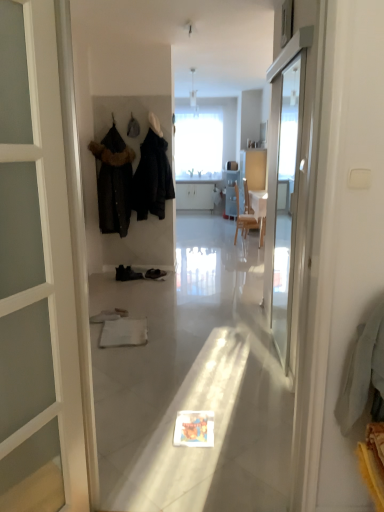
This screenshot has width=384, height=512. Identify the location of black fur-trimmed coat at left, which ranks as the first clothing in left-to-right order. (114, 182).

At what (x,y) coordinates should I click in order to perform the action: click on dark matte coat at center, placed as the 2th clothing when sorted from left to right. Please return your answer as a coordinate pair (x, y). The image size is (384, 512). Looking at the image, I should click on pyautogui.click(x=152, y=178).

What are the coordinates of `black fur-trimmed coat at left, which ranks as the first clothing in left-to-right order` in the screenshot? It's located at (114, 182).

From a real-world perspective, is transparent glass screen door at right above or below dark matte coat at center, placed as the 2th clothing when sorted from left to right?

In terms of real-world spatial position, transparent glass screen door at right is below dark matte coat at center, placed as the 2th clothing when sorted from left to right.

Can you confirm if transparent glass screen door at right is thinner than dark matte coat at center, placed as the 2th clothing when sorted from left to right?

Indeed, transparent glass screen door at right has a lesser width compared to dark matte coat at center, placed as the 2th clothing when sorted from left to right.

At what (x,y) coordinates should I click in order to perform the action: click on screen door that appears below the dark matte coat at center, placed as the 2th clothing when sorted from left to right (from a real-world perspective). Please return your answer as a coordinate pair (x, y). Looking at the image, I should click on (287, 203).

In the scene shown: Is transparent glass screen door at right taller or shorter than dark matte coat at center, placed as the 2th clothing when sorted from left to right?

Considering their sizes, transparent glass screen door at right has more height than dark matte coat at center, placed as the 2th clothing when sorted from left to right.

Is point (94, 154) positioned behind point (293, 158)?

Yes, it is behind point (293, 158).

Does black fur-trimmed coat at left, which ranks as the first clothing in left-to-right order, contain transparent glass screen door at right?

No.

Who is bigger, black fur-trimmed coat at left, the 2th clothing positioned from the right, or transparent glass screen door at right?

With larger size is black fur-trimmed coat at left, the 2th clothing positioned from the right.

Considering the sizes of objects dark matte coat at center, which ranks as the first clothing in right-to-left order, and transparent glass screen door at right in the image provided, who is smaller, dark matte coat at center, which ranks as the first clothing in right-to-left order, or transparent glass screen door at right?

Smaller between the two is transparent glass screen door at right.

Looking at this image, can you confirm if dark matte coat at center, which ranks as the first clothing in right-to-left order, is taller than transparent glass screen door at right?

No, dark matte coat at center, which ranks as the first clothing in right-to-left order, is not taller than transparent glass screen door at right.

From a real-world perspective, who is located lower, dark matte coat at center, placed as the 2th clothing when sorted from left to right, or transparent glass screen door at right?

From a 3D spatial view, transparent glass screen door at right is below.

Based on the photo, could you tell me if dark matte coat at center, placed as the 2th clothing when sorted from left to right, is facing black fur-trimmed coat at left, the 2th clothing positioned from the right?

No, dark matte coat at center, placed as the 2th clothing when sorted from left to right, does not turn towards black fur-trimmed coat at left, the 2th clothing positioned from the right.

Where is `clothing above the black fur-trimmed coat at left, the 2th clothing positioned from the right (from the image's perspective)`? The width and height of the screenshot is (384, 512). clothing above the black fur-trimmed coat at left, the 2th clothing positioned from the right (from the image's perspective) is located at coordinates (152, 178).

What's the angular difference between dark matte coat at center, which ranks as the first clothing in right-to-left order, and black fur-trimmed coat at left, which ranks as the first clothing in left-to-right order,'s facing directions?

There is a 0.86-degree angle between the facing directions of dark matte coat at center, which ranks as the first clothing in right-to-left order, and black fur-trimmed coat at left, which ranks as the first clothing in left-to-right order.

Is point (141, 173) farther from viewer compared to point (134, 158)?

Yes.

Can dark matte coat at center, placed as the 2th clothing when sorted from left to right, be found inside black fur-trimmed coat at left, the 2th clothing positioned from the right?

No, dark matte coat at center, placed as the 2th clothing when sorted from left to right, is not inside black fur-trimmed coat at left, the 2th clothing positioned from the right.

Which of these two, black fur-trimmed coat at left, the 2th clothing positioned from the right, or dark matte coat at center, which ranks as the first clothing in right-to-left order, is smaller?

black fur-trimmed coat at left, the 2th clothing positioned from the right.

Based on the photo, is black fur-trimmed coat at left, the 2th clothing positioned from the right, facing towards dark matte coat at center, which ranks as the first clothing in right-to-left order?

No, black fur-trimmed coat at left, the 2th clothing positioned from the right, is not oriented towards dark matte coat at center, which ranks as the first clothing in right-to-left order.

Locate an element on the screen. Image resolution: width=384 pixels, height=512 pixels. clothing located below the dark matte coat at center, which ranks as the first clothing in right-to-left order (from the image's perspective) is located at coordinates (114, 182).

In terms of width, does transparent glass screen door at right look wider or thinner when compared to black fur-trimmed coat at left, the 2th clothing positioned from the right?

Considering their sizes, transparent glass screen door at right looks slimmer than black fur-trimmed coat at left, the 2th clothing positioned from the right.

Can you tell me how much transparent glass screen door at right and black fur-trimmed coat at left, which ranks as the first clothing in left-to-right order, differ in facing direction?

The angle between the facing direction of transparent glass screen door at right and the facing direction of black fur-trimmed coat at left, which ranks as the first clothing in left-to-right order, is 90.5 degrees.

Which is closer, [294,231] or [108,201]?

The point [294,231] is in front.

From a real-world perspective, between transparent glass screen door at right and black fur-trimmed coat at left, which ranks as the first clothing in left-to-right order, who is vertically higher?

black fur-trimmed coat at left, which ranks as the first clothing in left-to-right order.

Identify the location of screen door located below the dark matte coat at center, placed as the 2th clothing when sorted from left to right (from the image's perspective). (287, 203).

Identify the location of screen door in front of the black fur-trimmed coat at left, the 2th clothing positioned from the right. The width and height of the screenshot is (384, 512). (287, 203).

When comparing their distances from black fur-trimmed coat at left, the 2th clothing positioned from the right, does dark matte coat at center, placed as the 2th clothing when sorted from left to right, or transparent glass screen door at right seem further?

Based on the image, transparent glass screen door at right appears to be further to black fur-trimmed coat at left, the 2th clothing positioned from the right.

Considering their positions, is black fur-trimmed coat at left, which ranks as the first clothing in left-to-right order, positioned further to dark matte coat at center, which ranks as the first clothing in right-to-left order, than transparent glass screen door at right?

transparent glass screen door at right is further to dark matte coat at center, which ranks as the first clothing in right-to-left order.

Considering their positions, is transparent glass screen door at right positioned closer to dark matte coat at center, placed as the 2th clothing when sorted from left to right, than black fur-trimmed coat at left, which ranks as the first clothing in left-to-right order?

black fur-trimmed coat at left, which ranks as the first clothing in left-to-right order, is positioned closer to the anchor dark matte coat at center, placed as the 2th clothing when sorted from left to right.

Looking at the image, which one is located closer to transparent glass screen door at right, dark matte coat at center, placed as the 2th clothing when sorted from left to right, or black fur-trimmed coat at left, which ranks as the first clothing in left-to-right order?

dark matte coat at center, placed as the 2th clothing when sorted from left to right.

Based on their spatial positions, is transparent glass screen door at right or dark matte coat at center, placed as the 2th clothing when sorted from left to right, closer to black fur-trimmed coat at left, the 2th clothing positioned from the right?

dark matte coat at center, placed as the 2th clothing when sorted from left to right, is positioned closer to the anchor black fur-trimmed coat at left, the 2th clothing positioned from the right.

From the image, which object appears to be nearer to transparent glass screen door at right, black fur-trimmed coat at left, which ranks as the first clothing in left-to-right order, or dark matte coat at center, placed as the 2th clothing when sorted from left to right?

Among the two, dark matte coat at center, placed as the 2th clothing when sorted from left to right, is located nearer to transparent glass screen door at right.

In order to click on clothing between transparent glass screen door at right and black fur-trimmed coat at left, the 2th clothing positioned from the right, from front to back in this screenshot , I will do `click(152, 178)`.